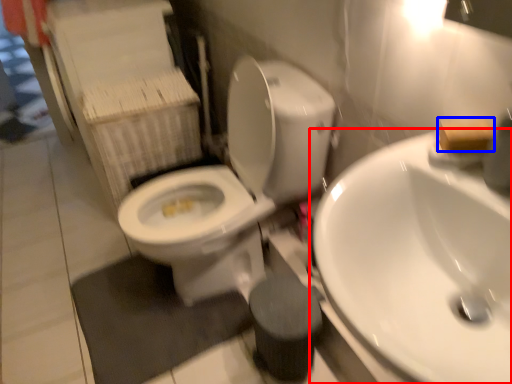
Question: Which point is closer to the camera, sink (highlighted by a red box) or soap (highlighted by a blue box)?

Choices:
 (A) sink
 (B) soap

Answer: (A)